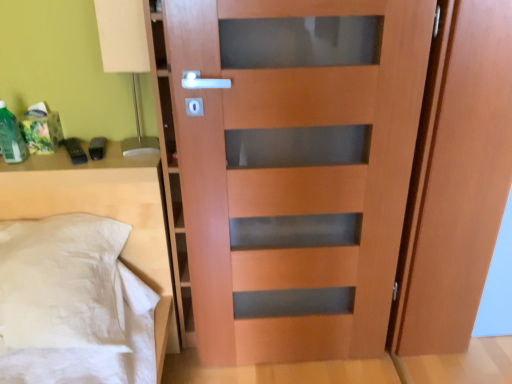
Locate an element on the screen. The height and width of the screenshot is (384, 512). vacant area that lies to the right of green matte bottle at left is located at coordinates (53, 160).